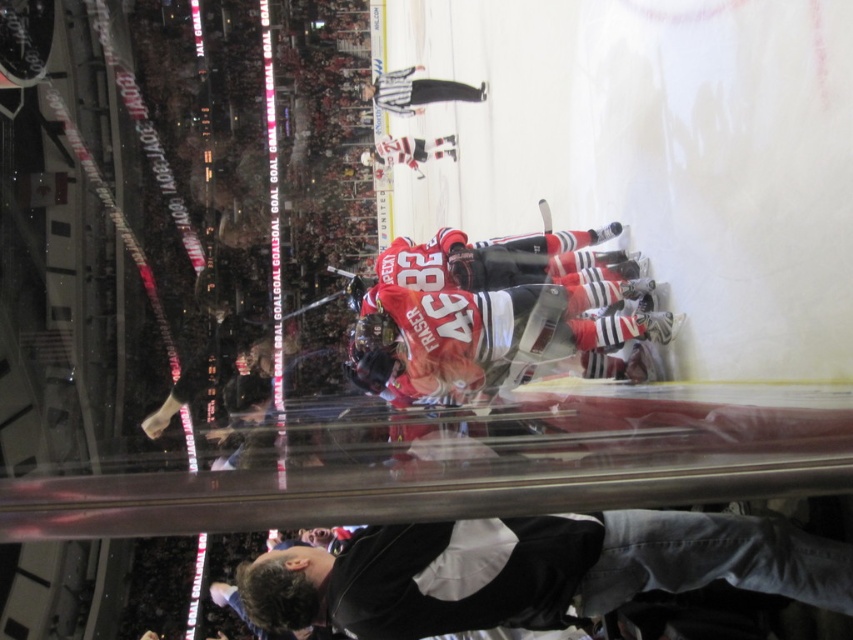
Question: Which object is positioned farthest from the dark gray jacket at lower center?

Choices:
 (A) black uniform at upper center
 (B) matte red jersey at center

Answer: (A)

Question: Which point appears farthest from the camera in this image?

Choices:
 (A) (412, 328)
 (B) (808, 532)

Answer: (A)

Question: Which point is closer to the camera?

Choices:
 (A) (556, 582)
 (B) (469, 100)
 (C) (384, 310)

Answer: (A)

Question: Does dark gray jacket at lower center have a lesser width compared to matte red jersey at center?

Choices:
 (A) no
 (B) yes

Answer: (A)

Question: Is dark gray jacket at lower center smaller than matte red jersey at center?

Choices:
 (A) yes
 (B) no

Answer: (B)

Question: Does matte red jersey at center appear over black uniform at upper center?

Choices:
 (A) no
 (B) yes

Answer: (A)